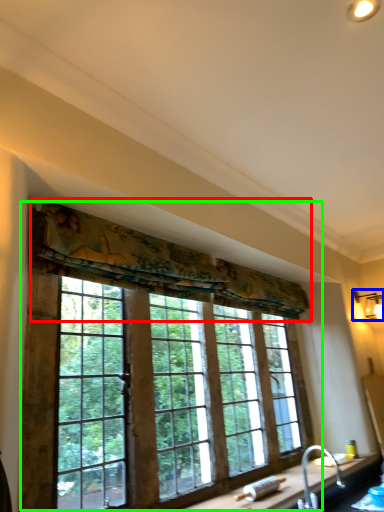
Question: Which object is the closest to the curtain (highlighted by a red box)? Choose among these: light fixture (highlighted by a blue box) or window (highlighted by a green box).

Choices:
 (A) light fixture
 (B) window

Answer: (B)